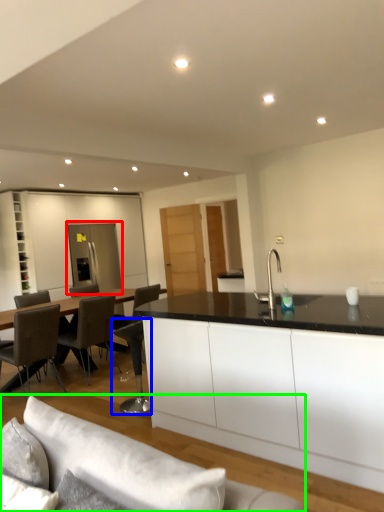
Question: Which object is the closest to the glass door (highlighted by a red box)? Choose among these: chair (highlighted by a blue box) or studio couch (highlighted by a green box).

Choices:
 (A) chair
 (B) studio couch

Answer: (A)